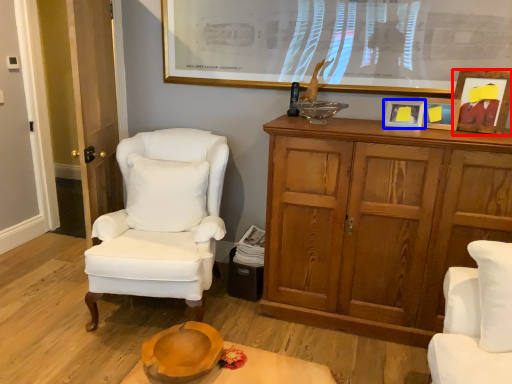
Question: Among these objects, which one is nearest to the camera, picture frame (highlighted by a red box) or picture frame (highlighted by a blue box)?

Choices:
 (A) picture frame
 (B) picture frame

Answer: (A)